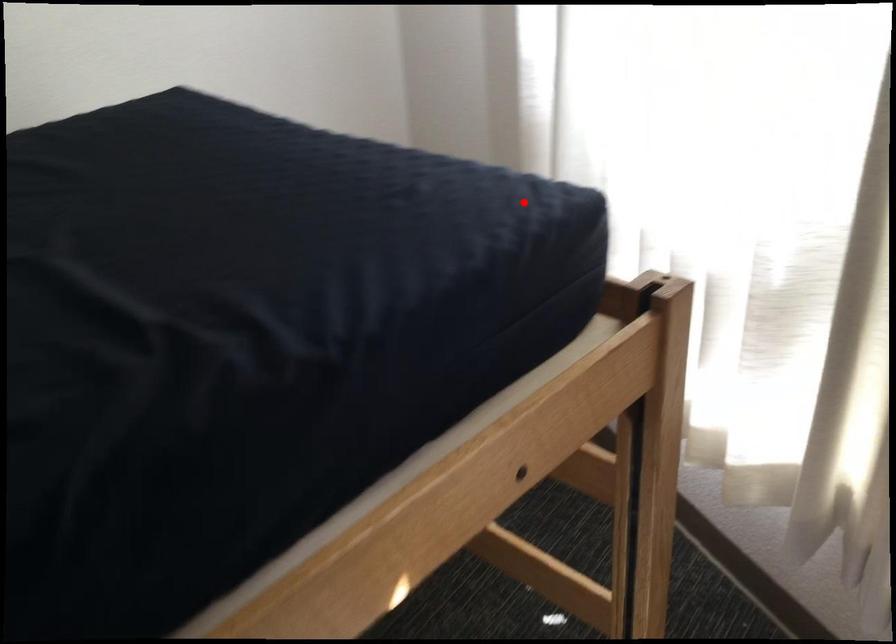
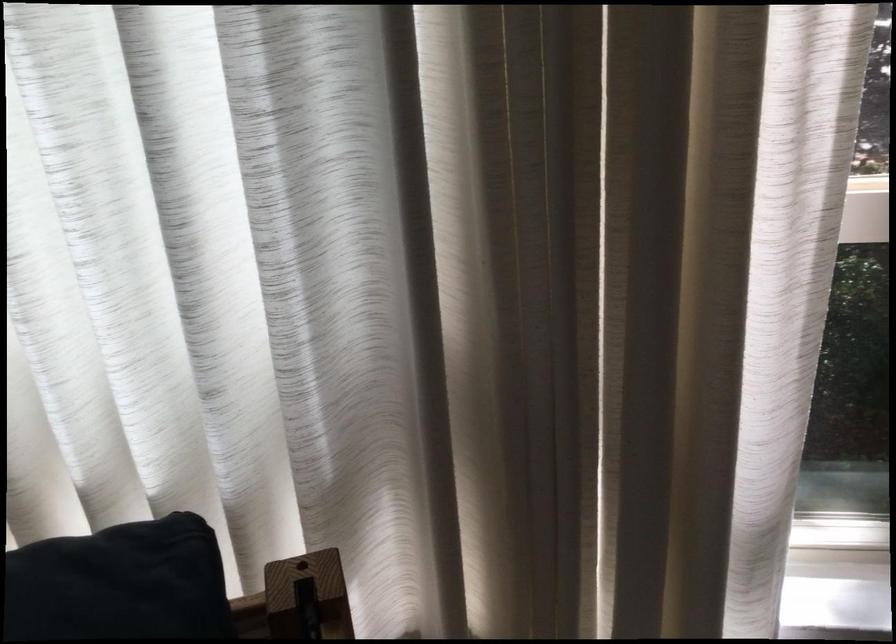
The point at the highlighted location is marked in the first image. Where is the corresponding point in the second image?

(119, 583)